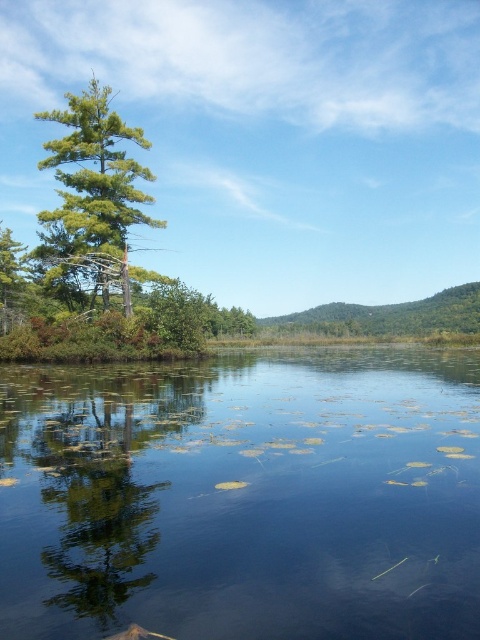
Does green leafy tree at center have a greater width compared to green matte tree at left?

No, green leafy tree at center is not wider than green matte tree at left.

Who is lower down, green leafy tree at center or green matte tree at left?

green leafy tree at center is lower down.

Does point (88, 605) come farther from viewer compared to point (108, 224)?

No, it is in front of (108, 224).

You are a GUI agent. You are given a task and a screenshot of the screen. Output one action in this format:
    pyautogui.click(x=<x>, y=<y>)
    Task: Click on the green leafy tree at center
    This screenshot has width=480, height=640.
    Given the screenshot: What is the action you would take?
    pyautogui.click(x=86, y=492)

Between green leafy water at center and green matte tree at left, which one has less height?

green leafy water at center is shorter.

Does green leafy water at center have a lesser width compared to green matte tree at left?

No, green leafy water at center is not thinner than green matte tree at left.

The image size is (480, 640). I want to click on green leafy water at center, so click(242, 497).

Between green leafy water at center and green leafy tree at center, which one has more height?

green leafy water at center is taller.

From the picture: Is green leafy water at center further to camera compared to green leafy tree at center?

That is False.

Does point (244, 516) come closer to viewer compared to point (49, 492)?

Yes.

This screenshot has height=640, width=480. In order to click on green leafy water at center in this screenshot , I will do `click(242, 497)`.